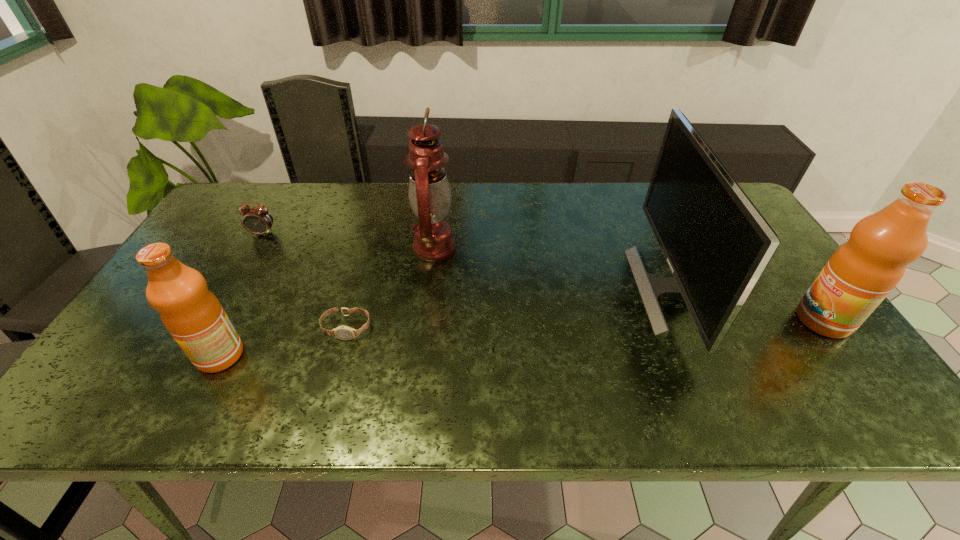
You are a GUI agent. You are given a task and a screenshot of the screen. Output one action in this format:
    pyautogui.click(x=<x>, y=<y>)
    Task: Click on the fruit juice that is at the near edge
    
    Given the screenshot: What is the action you would take?
    (192, 314)

Locate an element on the screen. The width and height of the screenshot is (960, 540). monitor that is at the near edge is located at coordinates (717, 244).

Find the location of a particular element. The height and width of the screenshot is (540, 960). object present at the left edge is located at coordinates (257, 220).

Image resolution: width=960 pixels, height=540 pixels. In order to click on object present at the right edge in this screenshot , I will do pyautogui.click(x=860, y=274).

What are the coordinates of `vacant region at the far edge of the desktop` in the screenshot? It's located at (344, 210).

Where is `vacant space at the near edge`? This screenshot has height=540, width=960. vacant space at the near edge is located at coordinates (709, 375).

What are the coordinates of `vacant space at the right edge of the desktop` in the screenshot? It's located at (775, 280).

What are the coordinates of `free space at the near right corner of the desktop` in the screenshot? It's located at (822, 368).

Find the location of a particular element. empty location between the monitor and the third shortest object is located at coordinates (445, 322).

At what (x,y) coordinates should I click in order to perform the action: click on free area in between the watch and the second object from right to left. Please return your answer as a coordinate pair (x, y). Looking at the image, I should click on (509, 309).